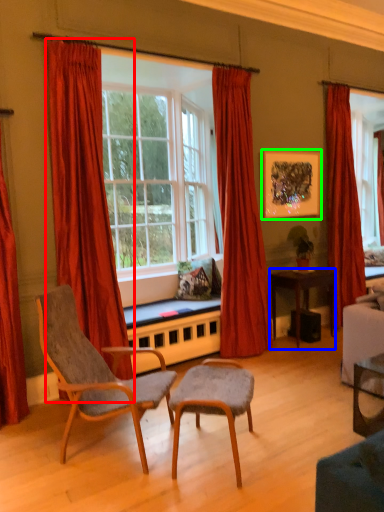
Question: Which object is positioned closest to curtain (highlighted by a red box)? Select from desk (highlighted by a blue box) and picture frame (highlighted by a green box).

Choices:
 (A) desk
 (B) picture frame

Answer: (B)